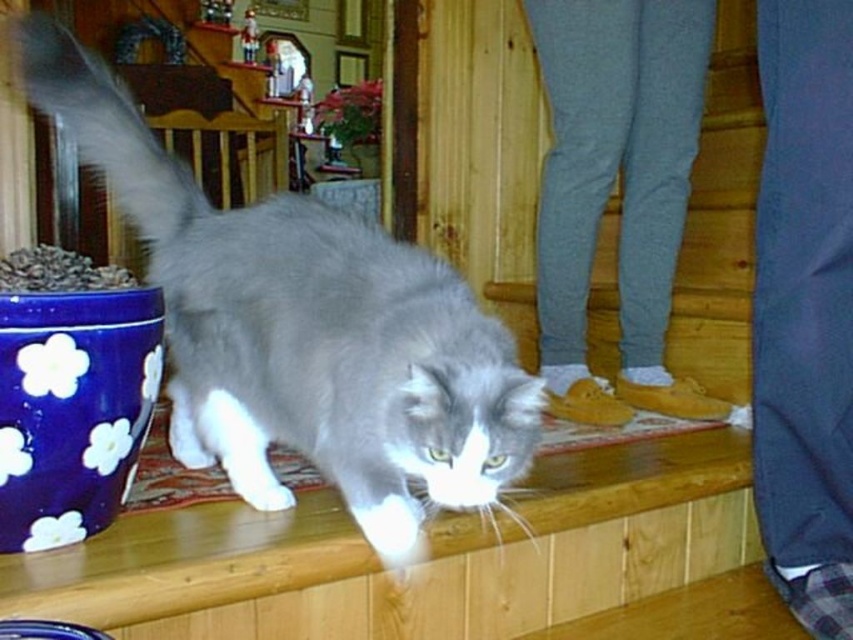
Looking at this image, you are a small toy that needs to roll from the gray fabric stairs at center to the fluffy white tail at upper left. Considering their heights, which direction should you roll to reach the tail?

The gray fabric stairs at center has a greater height compared to the fluffy white tail at upper left, so you should roll downward from the gray fabric stairs at center towards the fluffy white tail at upper left to reach it.

You are a visitor in this room and want to place a small gift on the wooden surface where the gray fluffy cat at center is sitting. However, you need to ensure it doesn not block the view of the blue matte flower pot at left. Where should you place the gift?

The gray fluffy cat at center is below the blue matte flower pot at left, so placing the gift on the wooden surface to the right of the cat would keep it out of the flower pot s line of sight.

You are a cat owner who wants to place a small toy between the gray fabric stairs at center and the fluffy white tail at upper left. Can you fit the toy in the space between them?

The gray fabric stairs at center is wider than the fluffy white tail at upper left, so there should be enough space to fit the toy between them.